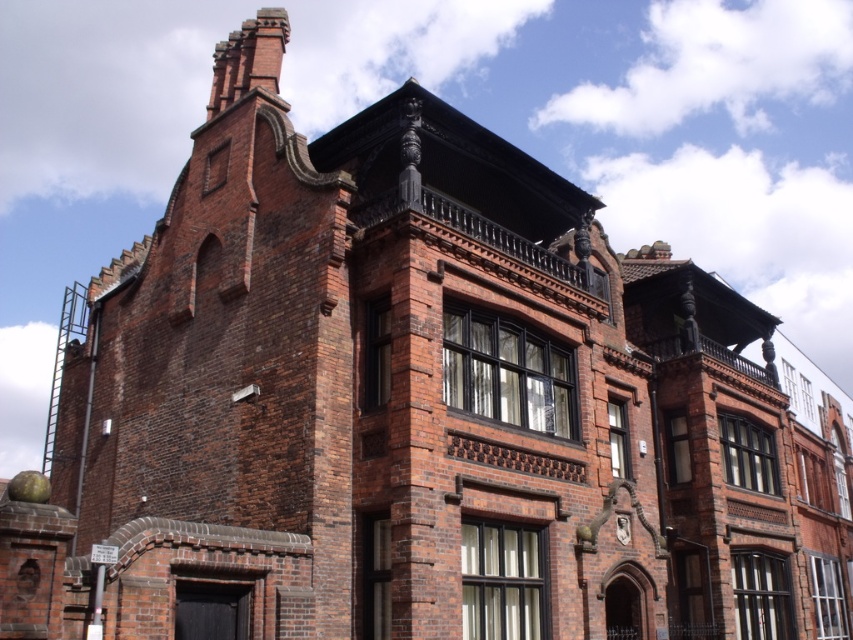
From the picture: Does red brick chimney at upper left have a smaller size compared to matte stone clock at upper center?

Actually, red brick chimney at upper left might be larger than matte stone clock at upper center.

At what (x,y) coordinates should I click in order to perform the action: click on red brick chimney at upper left. Please return your answer as a coordinate pair (x, y). Looking at the image, I should click on (248, 58).

The height and width of the screenshot is (640, 853). I want to click on red brick chimney at upper left, so click(x=248, y=58).